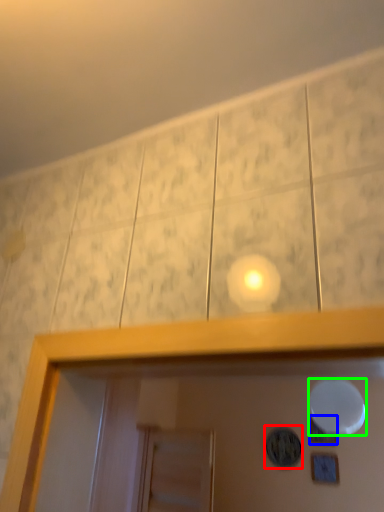
Question: Considering the real-world distances, which object is farthest from dot (highlighted by a red box)? dot (highlighted by a blue box) or mirror (highlighted by a green box)?

Choices:
 (A) dot
 (B) mirror

Answer: (B)